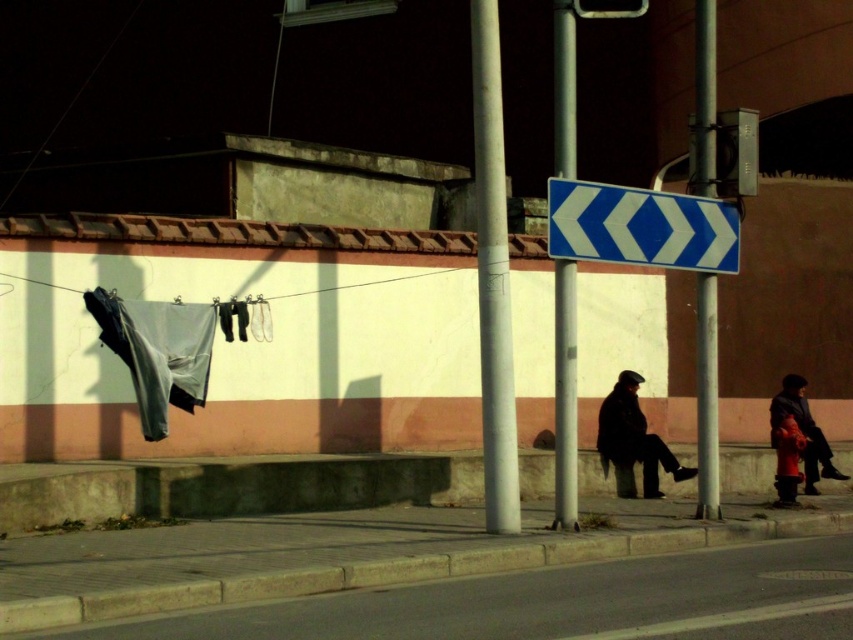
You are a painter setting up your easel to capture the urban scene. You want to include both the white smooth pole at center and the red matte jacket at lower right in your painting. Which object should you position higher on the canvas to maintain the correct proportions?

The white smooth pole at center should be positioned higher on the canvas since it is much taller than the red matte jacket at lower right.

You are a delivery person who needs to place a package between the white smooth pole at center and the red matte jacket at lower right. The package requires 5 meters of space. Is there enough space between them?

The distance between the white smooth pole at center and the red matte jacket at lower right is 4.63 meters, which is less than the required 5 meters. Therefore, there isn not enough space to place the package between them.